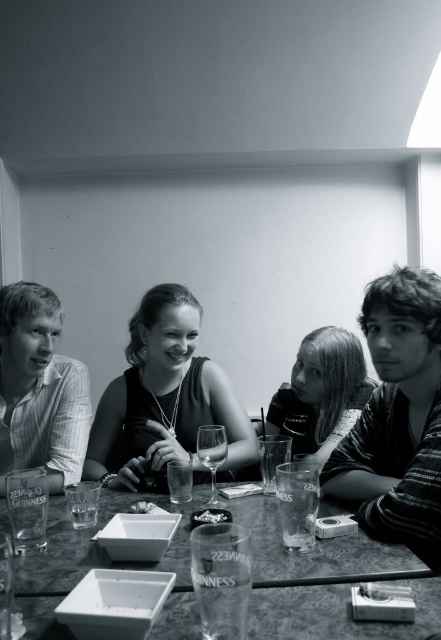
Question: Does transparent glass wine glass at center have a smaller size compared to white crumbly food at center?

Choices:
 (A) no
 (B) yes

Answer: (A)

Question: Which object is positioned farthest from the transparent glass wine glass at center?

Choices:
 (A) marbled stone dining table at center
 (B) striped cotton shirt at left
 (C) smooth black dress at center
 (D) smooth black hair at center

Answer: (D)

Question: Observing the image, what is the correct spatial positioning of marbled stone dining table at center in reference to striped cotton shirt at left?

Choices:
 (A) right
 (B) left

Answer: (A)

Question: Is smooth black dress at center wider than smooth black hair at center?

Choices:
 (A) no
 (B) yes

Answer: (B)

Question: Estimate the real-world distances between objects in this image. Which object is closer to the transparent glass wine glass at center?

Choices:
 (A) white crumbly food at center
 (B) marbled stone dining table at center

Answer: (A)

Question: Among these points, which one is farthest from the camera?

Choices:
 (A) (78, 422)
 (B) (141, 512)
 (C) (268, 420)
 (D) (204, 496)

Answer: (C)